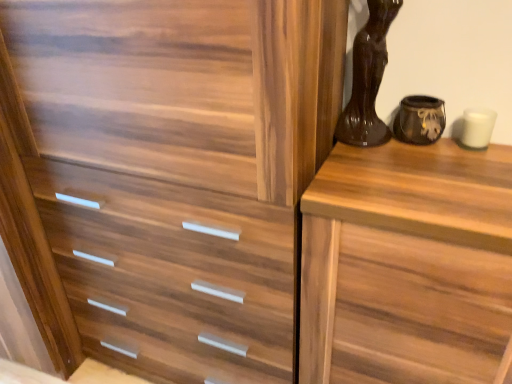
Identify the location of free space to the left of matte black vase at upper right, arranged as the 2th vase when viewed from the left. (367, 155).